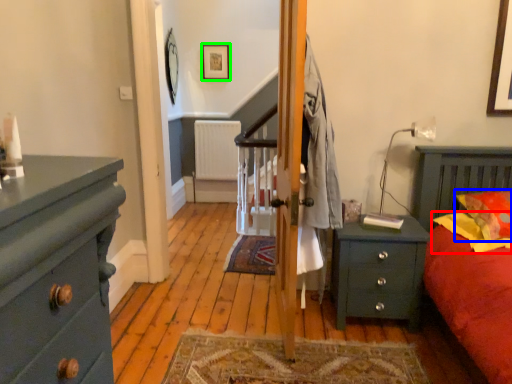
Question: Which object is the closest to the pillow (highlighted by a red box)? Choose among these: pillow (highlighted by a blue box) or picture frame (highlighted by a green box).

Choices:
 (A) pillow
 (B) picture frame

Answer: (A)